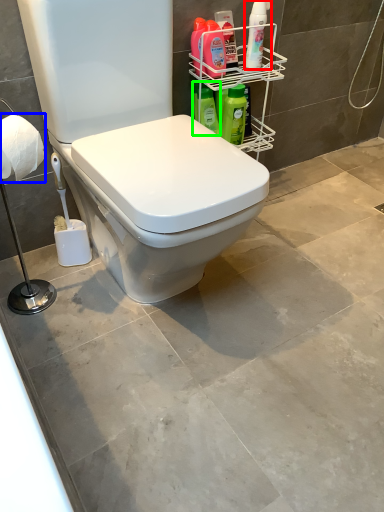
Question: Which object is positioned closest to cleaning product (highlighted by a red box)? Select from toilet paper (highlighted by a blue box) and cleaning product (highlighted by a green box).

Choices:
 (A) toilet paper
 (B) cleaning product

Answer: (B)